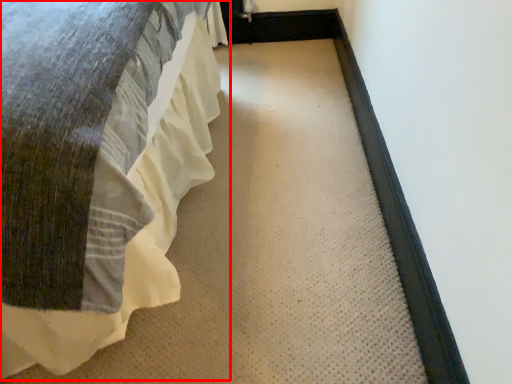
Question: From the image's perspective, where is bed (annotated by the red box) located relative to doormat?

Choices:
 (A) below
 (B) above

Answer: (B)